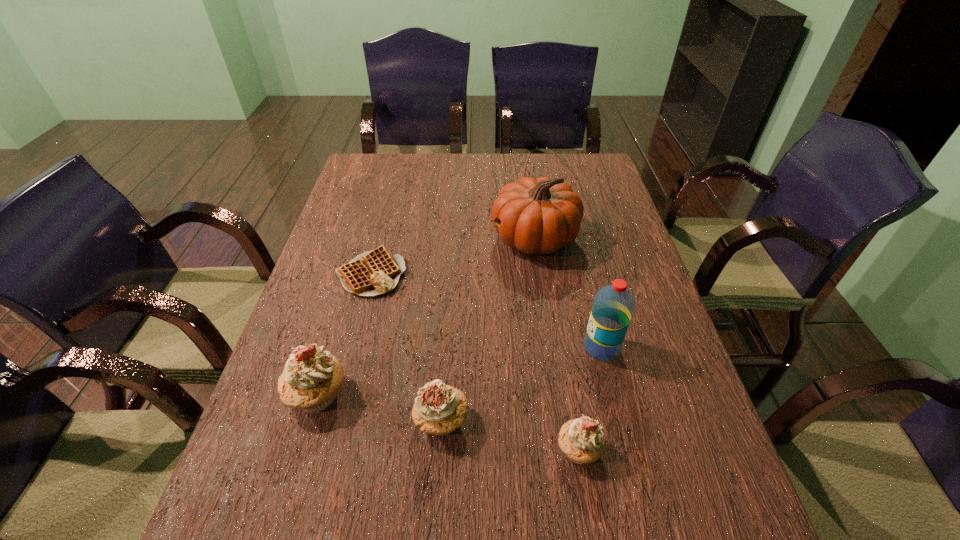
With all cupcakes evenly spaced, where should an extra cupcake be placed on the right to continue the pattern? Please point out a vacant space. Please provide its 2D coordinates. Your answer should be formatted as a tuple, i.e. [(x, y)], where the tuple contains the x and y coordinates of a point satisfying the conditions above.

[(731, 482)]